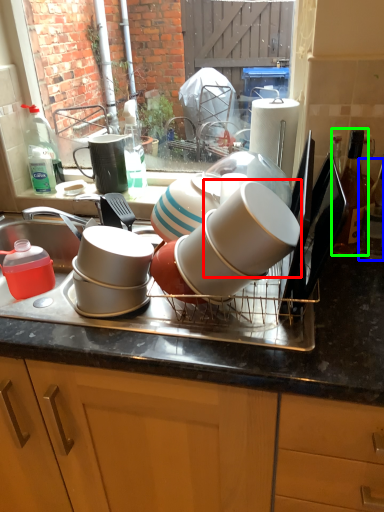
Question: Considering the real-world distances, which object is farthest from tableware (highlighted by a red box)? bottle (highlighted by a blue box) or bottle (highlighted by a green box)?

Choices:
 (A) bottle
 (B) bottle

Answer: (A)